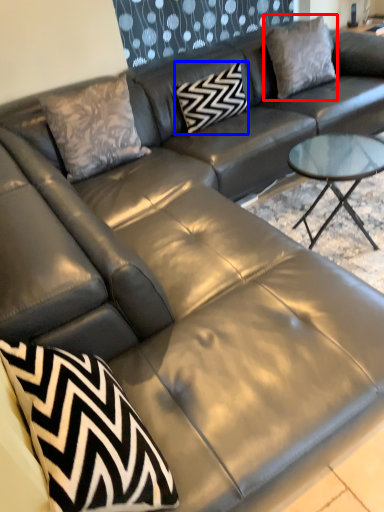
Question: Which point is closer to the camera, pillow (highlighted by a red box) or pillow (highlighted by a blue box)?

Choices:
 (A) pillow
 (B) pillow

Answer: (B)